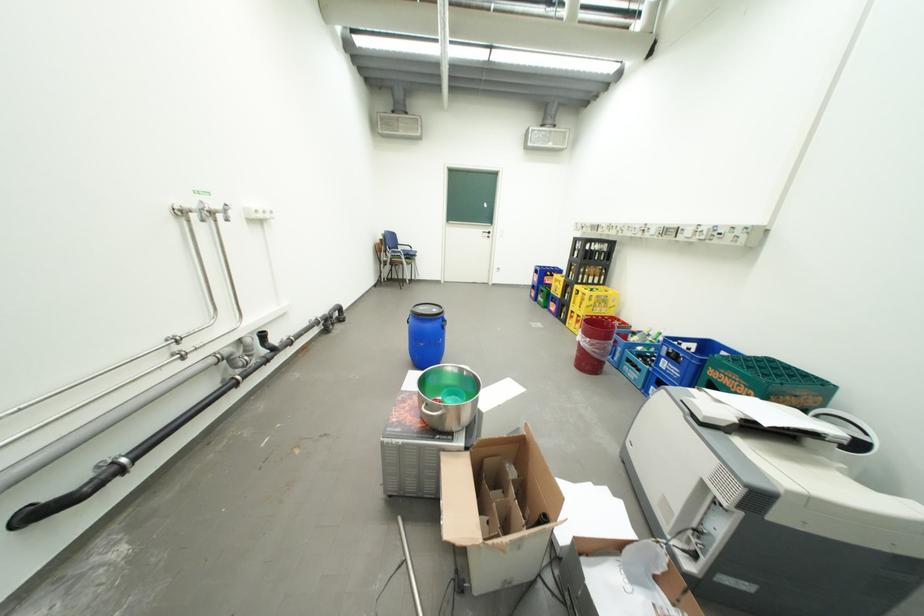
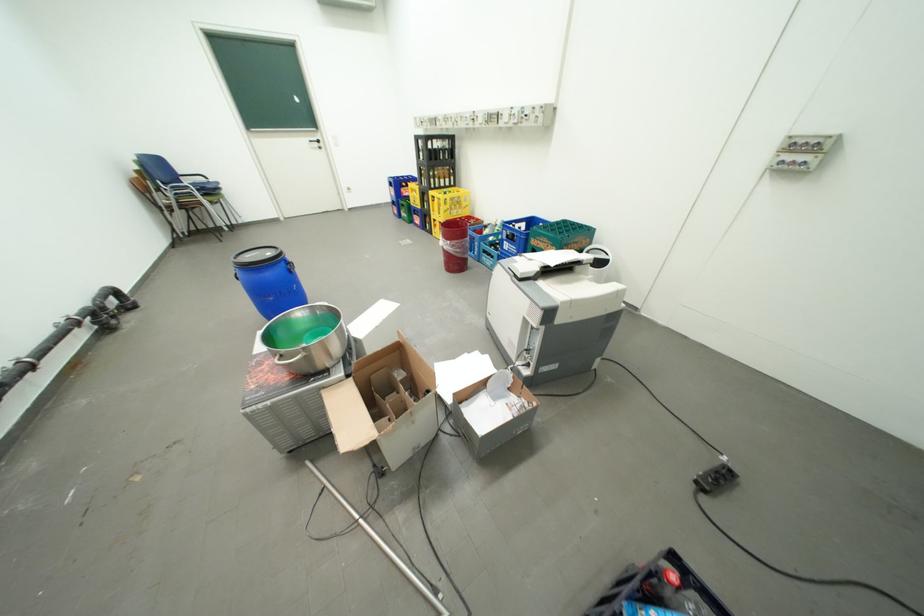
Where in the second image is the point corresponding to point (674, 361) from the first image?

(516, 244)